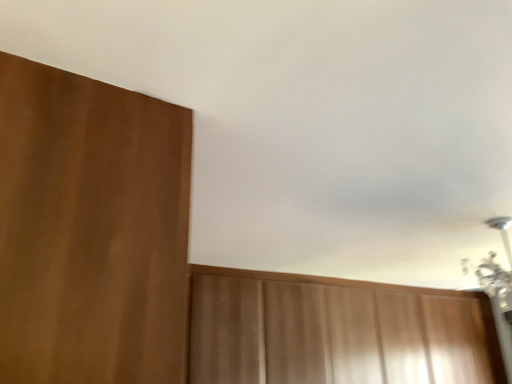
What is the approximate height of wooden curtain at center?

The height of wooden curtain at center is 32.75 inches.

What do you see at coordinates (336, 331) in the screenshot? This screenshot has height=384, width=512. I see `wooden curtain at center` at bounding box center [336, 331].

Where is `wooden curtain at center`? wooden curtain at center is located at coordinates (336, 331).

The width and height of the screenshot is (512, 384). I want to click on wooden curtain at center, so click(x=336, y=331).